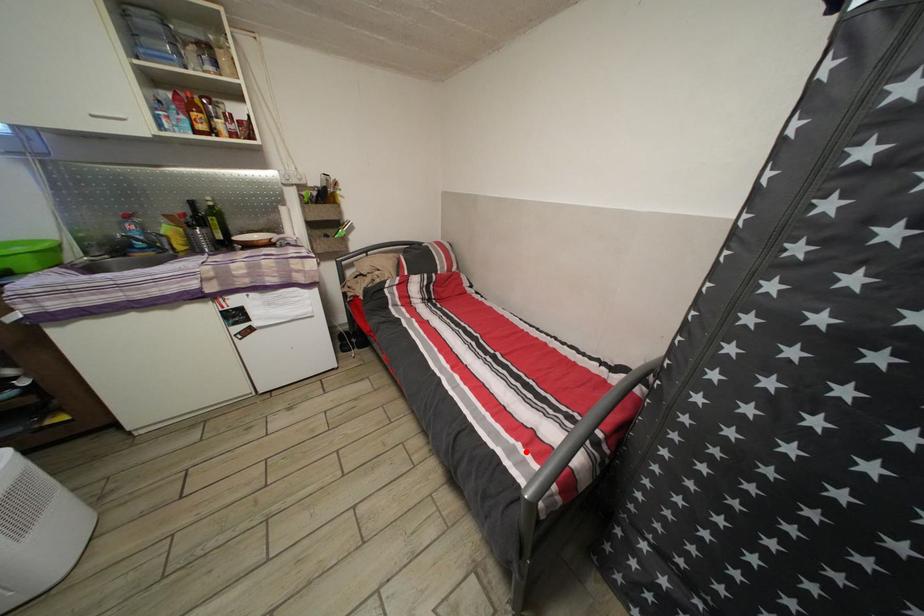
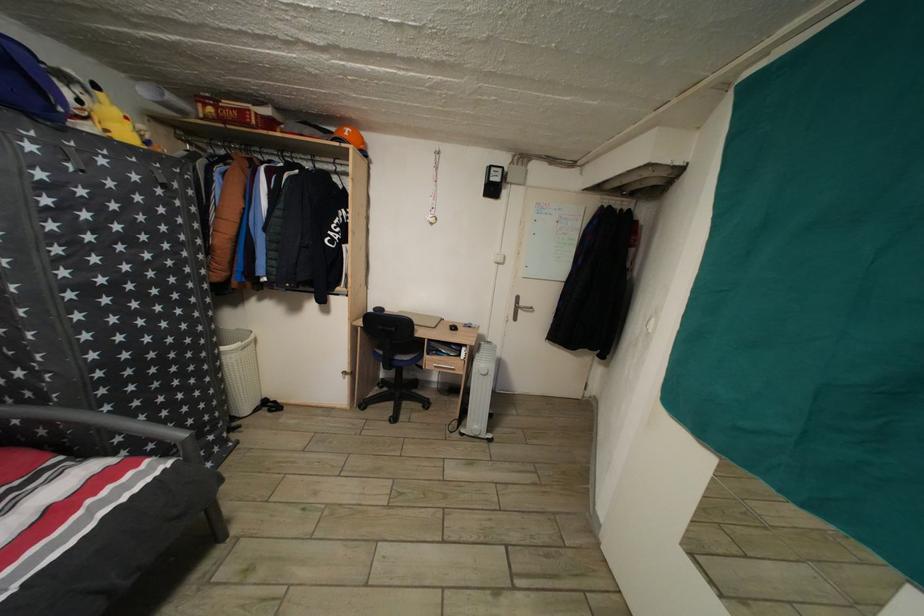
The point at the highlighted location is marked in the first image. Where is the corresponding point in the second image?

(96, 508)